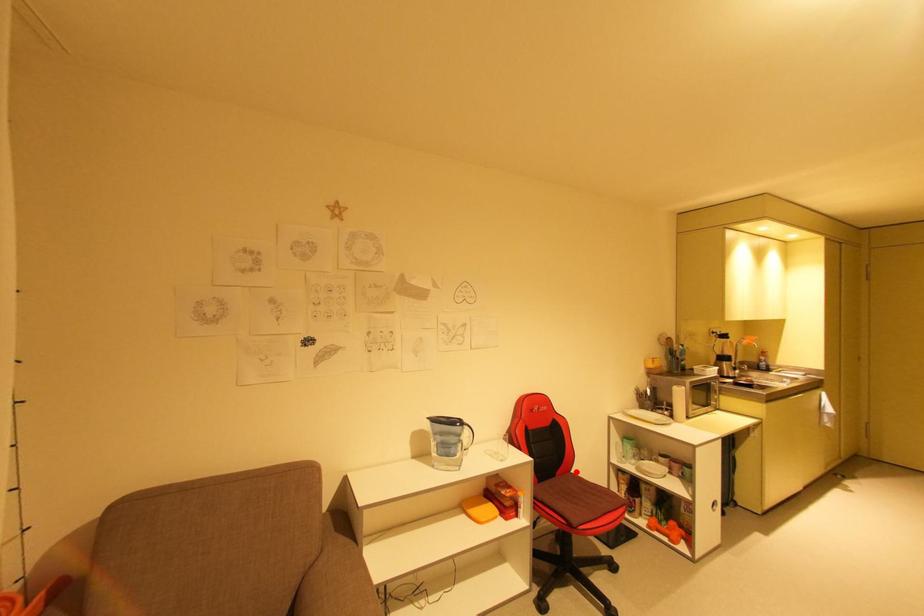
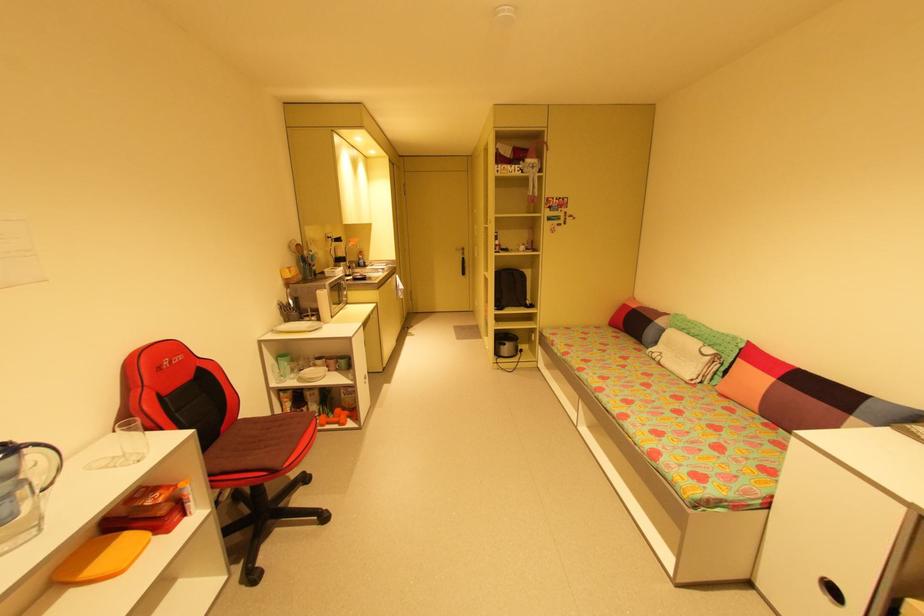
Question: I am providing you with two images of the same scene from different viewpoints. Image1 has a red point marked. In image2, the corresponding 3D location appears at what relative position? Reply with the corresponding letter.

Choices:
 (A) Closer
 (B) Farther

Answer: (A)